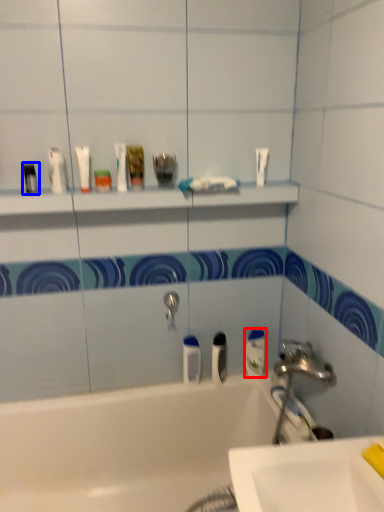
Question: Which of the following is the farthest to the observer, mouthwash (highlighted by a red box) or toiletry (highlighted by a blue box)?

Choices:
 (A) mouthwash
 (B) toiletry

Answer: (A)